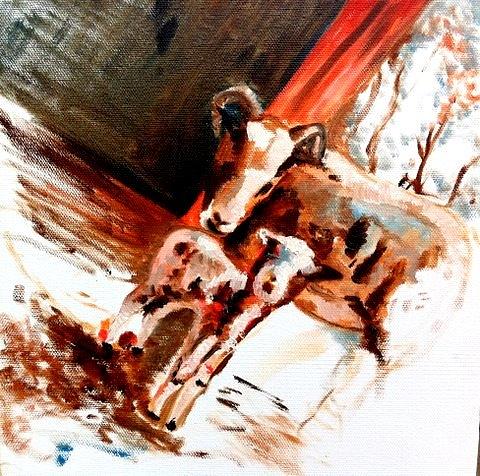
In order to click on frame in this screenshot , I will do `click(314, 85)`.